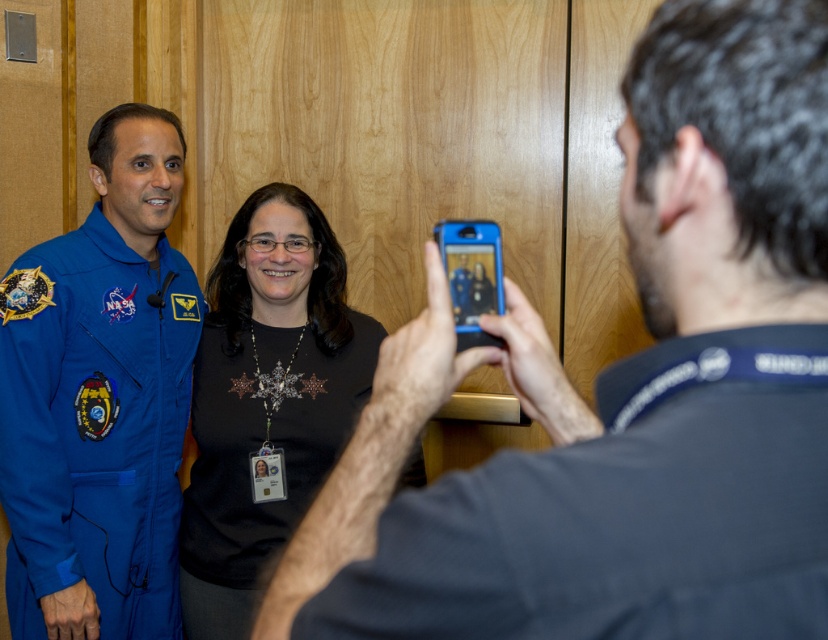
Looking at this image, can you confirm if dark blue shirt at center is bigger than blue fabric astronaut suit at left?

Actually, dark blue shirt at center might be smaller than blue fabric astronaut suit at left.

Who is lower down, dark blue shirt at center or blue fabric astronaut suit at left?

blue fabric astronaut suit at left is lower down.

Measure the distance between point (528,452) and camera.

Point (528,452) and camera are 17.24 inches apart.

Where is `dark blue shirt at center`? dark blue shirt at center is located at coordinates (622, 392).

Can you confirm if dark blue shirt at center is thinner than black matte shirt at center?

Yes, dark blue shirt at center is thinner than black matte shirt at center.

Is point (651, 504) in front of point (195, 605)?

Yes, point (651, 504) is closer to viewer.

Where is `dark blue shirt at center`? Image resolution: width=828 pixels, height=640 pixels. dark blue shirt at center is located at coordinates (622, 392).

Which is above, blue fabric astronaut suit at left or black matte shirt at center?

Positioned higher is blue fabric astronaut suit at left.

Is blue fabric astronaut suit at left smaller than black matte shirt at center?

Yes, blue fabric astronaut suit at left is smaller than black matte shirt at center.

Between point (167, 429) and point (258, 272), which one is positioned behind?

The point (258, 272) is behind.

I want to click on blue fabric astronaut suit at left, so click(100, 397).